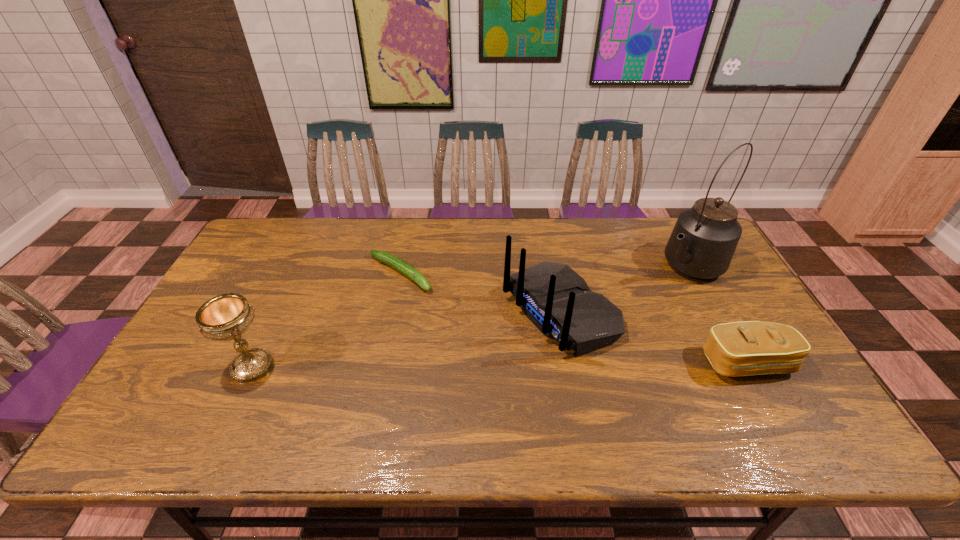
Where is `free space at the far left corner`? free space at the far left corner is located at coordinates (277, 236).

This screenshot has height=540, width=960. I want to click on vacant space that is in between the third object from right to left and the chalice, so click(406, 339).

At what (x,y) coordinates should I click in order to perform the action: click on vacant area that lies between the leftmost object and the zucchini. Please return your answer as a coordinate pair (x, y). Image resolution: width=960 pixels, height=540 pixels. Looking at the image, I should click on (326, 320).

Find the location of a particular element. free area in between the router and the tallest object is located at coordinates (623, 288).

Find the location of a particular element. The height and width of the screenshot is (540, 960). vacant area that lies between the zucchini and the third object from left to right is located at coordinates (479, 293).

The width and height of the screenshot is (960, 540). Identify the location of empty location between the router and the chalice. (406, 339).

In order to click on unoccupied position between the leftmost object and the kettle in this screenshot , I will do `click(469, 316)`.

You are a GUI agent. You are given a task and a screenshot of the screen. Output one action in this format:
    pyautogui.click(x=<x>, y=<y>)
    Task: Click on the vacant area between the chalice and the kettle
    This screenshot has height=540, width=960.
    Given the screenshot: What is the action you would take?
    pyautogui.click(x=469, y=316)

This screenshot has width=960, height=540. In order to click on free space between the leftmost object and the third object from left to right in this screenshot , I will do `click(406, 339)`.

Identify the location of vacant area that lies between the chalice and the fourth object from right to left. (326, 320).